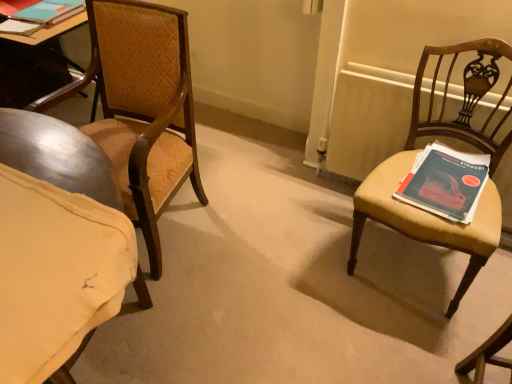
Question: Considering the relative positions of matte brown chair at right, which is the first chair in right-to-left order, and wooden radiator at right in the image provided, is matte brown chair at right, which is the first chair in right-to-left order, in front of wooden radiator at right?

Choices:
 (A) yes
 (B) no

Answer: (A)

Question: Can you confirm if matte brown chair at right, arranged as the 2th chair when viewed from the left, is wider than wooden radiator at right?

Choices:
 (A) yes
 (B) no

Answer: (A)

Question: Does matte brown chair at right, arranged as the 2th chair when viewed from the left, have a lesser width compared to wooden radiator at right?

Choices:
 (A) no
 (B) yes

Answer: (A)

Question: From the image's perspective, is matte brown chair at right, which is the first chair in right-to-left order, on top of wooden radiator at right?

Choices:
 (A) yes
 (B) no

Answer: (B)

Question: Is wooden radiator at right located within matte brown chair at right, arranged as the 2th chair when viewed from the left?

Choices:
 (A) no
 (B) yes

Answer: (A)

Question: From a real-world perspective, does matte brown chair at right, which is the first chair in right-to-left order, sit lower than wooden radiator at right?

Choices:
 (A) yes
 (B) no

Answer: (B)

Question: Can you confirm if wooden radiator at right is wider than matte blue book at right, which is the first book in bottom-to-top order?

Choices:
 (A) no
 (B) yes

Answer: (A)

Question: Is wooden radiator at right next to matte blue book at right, which is the 2th book from back to front?

Choices:
 (A) no
 (B) yes

Answer: (A)

Question: From a real-world perspective, is wooden radiator at right physically above matte blue book at right, which is the 2th book from back to front?

Choices:
 (A) no
 (B) yes

Answer: (A)

Question: Can you confirm if wooden radiator at right is positioned to the right of matte blue book at right, which appears as the second book when viewed from the left?

Choices:
 (A) no
 (B) yes

Answer: (B)

Question: Does wooden radiator at right have a smaller size compared to matte blue book at right, which appears as the first book when viewed from the front?

Choices:
 (A) yes
 (B) no

Answer: (B)

Question: Is matte blue book at right, which appears as the second book when viewed from the left, surrounded by wooden radiator at right?

Choices:
 (A) no
 (B) yes

Answer: (A)

Question: From a real-world perspective, does matte blue book at right, which appears as the first book when viewed from the front, sit lower than wooden radiator at right?

Choices:
 (A) no
 (B) yes

Answer: (A)